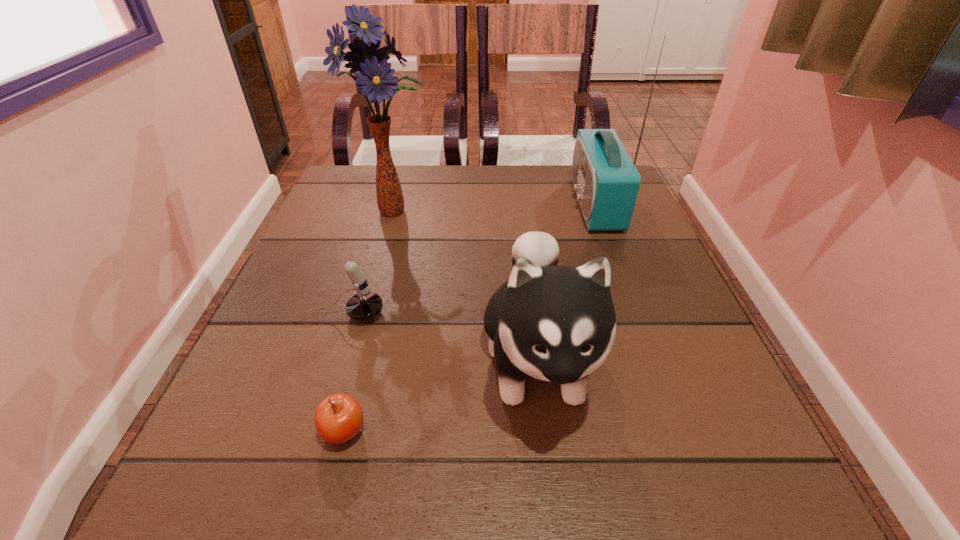
Locate an element on the screen. free spot located 0.060m at the face of the fourth object from left to right is located at coordinates (556, 505).

The image size is (960, 540). I want to click on vacant space located 0.100m on the right of the second shortest object, so click(440, 314).

Image resolution: width=960 pixels, height=540 pixels. I want to click on free space located on the left of the apple, so click(265, 431).

Find the location of `flower arrangement that is at the far edge`. flower arrangement that is at the far edge is located at coordinates (374, 76).

Where is `radio receiver that is at the far edge`? The width and height of the screenshot is (960, 540). radio receiver that is at the far edge is located at coordinates (606, 181).

At what (x,y) coordinates should I click in order to perform the action: click on puppy present at the near edge. Please return your answer as a coordinate pair (x, y). Looking at the image, I should click on (556, 323).

You are a GUI agent. You are given a task and a screenshot of the screen. Output one action in this format:
    pyautogui.click(x=<x>, y=<y>)
    Task: Click on the apple at the near edge
    The image size is (960, 540).
    Given the screenshot: What is the action you would take?
    pyautogui.click(x=338, y=418)

This screenshot has width=960, height=540. I want to click on flower arrangement that is at the left edge, so [x=374, y=76].

Where is `microphone located at the left edge`? microphone located at the left edge is located at coordinates (365, 305).

The image size is (960, 540). In order to click on apple that is positioned at the left edge in this screenshot , I will do `click(338, 418)`.